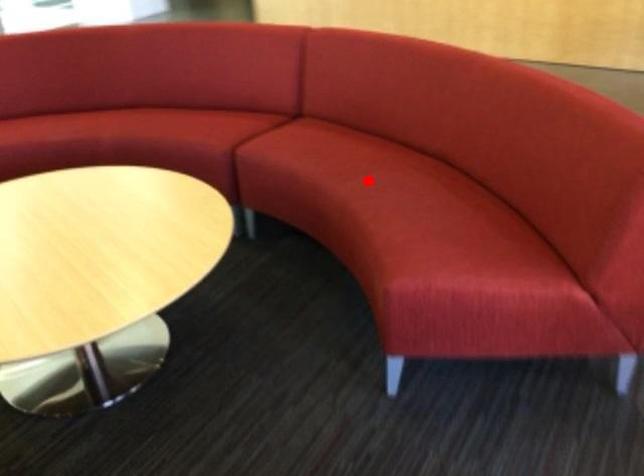
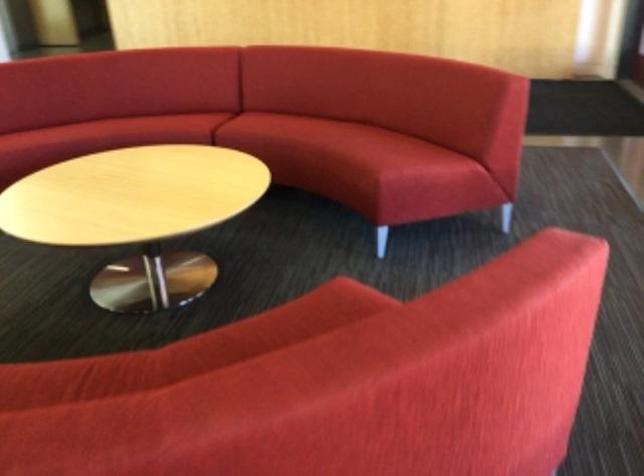
Question: I am providing you with two images of the same scene from different viewpoints. Image1 has a red point marked. In image2, the corresponding 3D location appears at what relative position? Reply with the corresponding letter.

Choices:
 (A) Closer
 (B) Farther

Answer: (B)